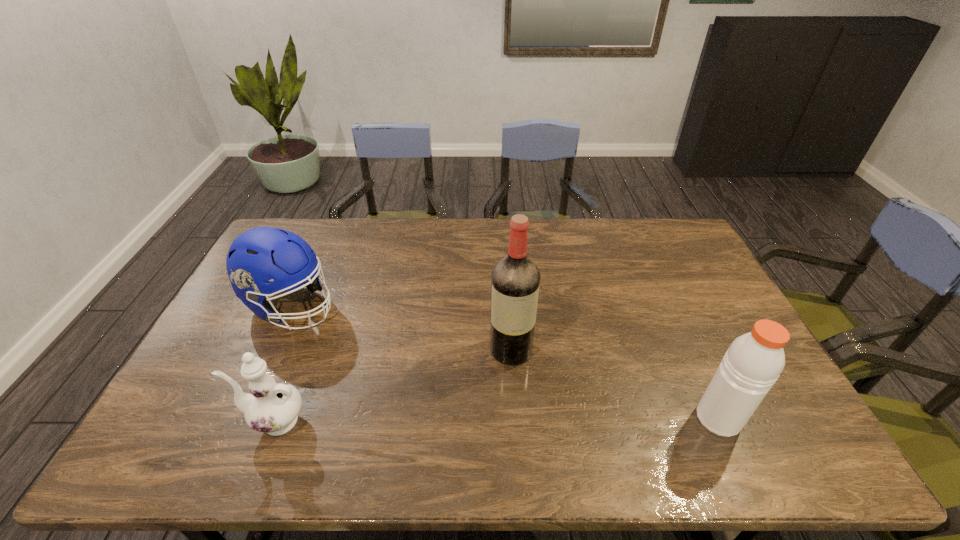
This screenshot has width=960, height=540. Find the location of `free location at the far edge of the desktop`. free location at the far edge of the desktop is located at coordinates (509, 224).

I want to click on free space at the near edge of the desktop, so click(310, 408).

Identify the location of vacant space at the left edge of the desktop. The height and width of the screenshot is (540, 960). (210, 364).

Find the location of `free space at the near left corner`. free space at the near left corner is located at coordinates (206, 423).

Locate an element on the screen. vacant space at the far right corner of the desktop is located at coordinates (659, 245).

Locate an element on the screen. The image size is (960, 540). free space between the liquor and the football helmet is located at coordinates (401, 327).

The image size is (960, 540). In order to click on unoccupied area between the rightmost object and the tallest object in this screenshot , I will do `click(614, 384)`.

Where is `vacant point located between the football helmet and the liquor`? vacant point located between the football helmet and the liquor is located at coordinates (401, 327).

Where is `vacant point located between the tallest object and the chinaware`? vacant point located between the tallest object and the chinaware is located at coordinates (393, 386).

Find the location of `free spot between the shaker and the chinaware`. free spot between the shaker and the chinaware is located at coordinates (496, 420).